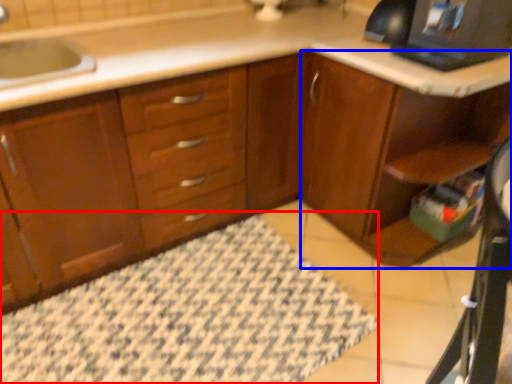
Question: Which point is further to the camera, bath mat (highlighted by a red box) or dresser (highlighted by a blue box)?

Choices:
 (A) bath mat
 (B) dresser

Answer: (B)